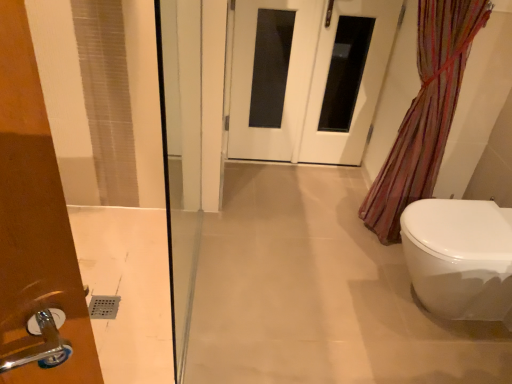
This screenshot has width=512, height=384. In order to click on white glossy door at center in this screenshot , I will do `click(268, 78)`.

What do you see at coordinates (307, 77) in the screenshot? I see `white glossy door at center` at bounding box center [307, 77].

You are a GUI agent. You are given a task and a screenshot of the screen. Output one action in this format:
    pyautogui.click(x=<x>, y=<y>)
    Task: Click on the translucent striped fabric at right
    
    Given the screenshot: What is the action you would take?
    pyautogui.click(x=425, y=113)

Find the location of `door to the right of white glossy door at center`. door to the right of white glossy door at center is located at coordinates (307, 77).

Is white glossy door at center wider or thinner than white glossy door at center?

white glossy door at center is wider than white glossy door at center.

Is white glossy door at center situated inside white glossy door at center or outside?

white glossy door at center is inside white glossy door at center.

Which is in front, white glossy door at center or white glossy door at center?

Positioned in front is white glossy door at center.

Are translucent striped fabric at right and white glossy door at center far apart?

That's not correct — translucent striped fabric at right is a little close to white glossy door at center.

Considering the positions of objects translucent striped fabric at right and white glossy door at center in the image provided, who is more to the left, translucent striped fabric at right or white glossy door at center?

From the viewer's perspective, white glossy door at center appears more on the left side.

What's the angular difference between translucent striped fabric at right and white glossy door at center's facing directions?

The angular difference between translucent striped fabric at right and white glossy door at center is 0.855 degrees.

From the image's perspective, between translucent striped fabric at right and white glossy door at center, which one is located above?

white glossy door at center, from the image's perspective.

Considering the points (418, 28) and (455, 228), which point is behind, point (418, 28) or point (455, 228)?

The point (418, 28) is more distant.

Would you consider translucent striped fabric at right to be distant from white glossy toilet at lower right?

Actually, translucent striped fabric at right and white glossy toilet at lower right are a little close together.

Who is taller, translucent striped fabric at right or white glossy toilet at lower right?

With more height is translucent striped fabric at right.

In terms of width, does translucent striped fabric at right look wider or thinner when compared to white glossy toilet at lower right?

Clearly, translucent striped fabric at right has less width compared to white glossy toilet at lower right.

From the image's perspective, is white glossy door at center under translucent striped fabric at right?

No.

Could you tell me if white glossy door at center is facing translucent striped fabric at right?

No, white glossy door at center is not facing towards translucent striped fabric at right.

Is white glossy door at center next to translucent striped fabric at right?

No, white glossy door at center is not touching translucent striped fabric at right.

Between white glossy door at center and translucent striped fabric at right, which one has more height?

translucent striped fabric at right.

From the image's perspective, is white glossy toilet at lower right located beneath translucent striped fabric at right?

Indeed, from the image's perspective, white glossy toilet at lower right is shown beneath translucent striped fabric at right.

Is the surface of white glossy toilet at lower right in direct contact with translucent striped fabric at right?

No, white glossy toilet at lower right is not in contact with translucent striped fabric at right.

What's the angular difference between white glossy toilet at lower right and translucent striped fabric at right's facing directions?

The facing directions of white glossy toilet at lower right and translucent striped fabric at right are 91 degrees apart.

Could you tell me if white glossy toilet at lower right is turned towards translucent striped fabric at right?

No, white glossy toilet at lower right does not turn towards translucent striped fabric at right.

Is there a large distance between white glossy door at center and white glossy toilet at lower right?

white glossy door at center is positioned a significant distance from white glossy toilet at lower right.

Is white glossy door at center closer to the viewer compared to white glossy toilet at lower right?

That is False.

From a real-world perspective, is white glossy door at center on top of white glossy toilet at lower right?

Yes, from a real-world perspective, white glossy door at center is over white glossy toilet at lower right

Consider the image. Could white glossy toilet at lower right be considered to be inside white glossy door at center?

No, white glossy toilet at lower right is not a part of white glossy door at center.

Is translucent striped fabric at right at the back of white glossy door at center?

That's not correct — white glossy door at center is not looking away from translucent striped fabric at right.

In the scene shown: Is white glossy door at center next to translucent striped fabric at right and touching it?

No, white glossy door at center is not touching translucent striped fabric at right.

I want to click on door behind the translucent striped fabric at right, so click(307, 77).

Identify the location of door to the right of white glossy door at center. click(x=307, y=77).

Locate an element on the screen. This screenshot has height=384, width=512. screen door above the translucent striped fabric at right (from the image's perspective) is located at coordinates (268, 78).

Which object lies further to the anchor point white glossy toilet at lower right, translucent striped fabric at right or white glossy door at center?

white glossy door at center lies further to white glossy toilet at lower right than the other object.

When comparing their distances from white glossy door at center, does white glossy toilet at lower right or translucent striped fabric at right seem further?

white glossy toilet at lower right lies further to white glossy door at center than the other object.

From the image, which object appears to be farther from translucent striped fabric at right, white glossy toilet at lower right or white glossy door at center?

white glossy door at center is further to translucent striped fabric at right.

Which object lies further to the anchor point white glossy toilet at lower right, translucent striped fabric at right or white glossy door at center?

white glossy door at center lies further to white glossy toilet at lower right than the other object.

Looking at the image, which one is located further to white glossy toilet at lower right, white glossy door at center or translucent striped fabric at right?

white glossy door at center is further to white glossy toilet at lower right.

Considering their positions, is white glossy door at center positioned closer to white glossy toilet at lower right than white glossy door at center?

white glossy door at center lies closer to white glossy toilet at lower right than the other object.

From the image, which object appears to be farther from white glossy door at center, translucent striped fabric at right or white glossy door at center?

translucent striped fabric at right is further to white glossy door at center.

Based on the photo, from the image, which object appears to be farther from translucent striped fabric at right, white glossy door at center or white glossy door at center?

Among the two, white glossy door at center is located further to translucent striped fabric at right.

Find the location of a particular element. This screenshot has width=512, height=384. shower curtain that lies between white glossy door at center and white glossy toilet at lower right from top to bottom is located at coordinates (425, 113).

This screenshot has width=512, height=384. In order to click on door positioned between translucent striped fabric at right and white glossy door at center from near to far in this screenshot , I will do `click(307, 77)`.

This screenshot has height=384, width=512. In order to click on screen door between white glossy door at center and white glossy toilet at lower right in the up-down direction in this screenshot , I will do `click(268, 78)`.

Identify the location of shower curtain between white glossy door at center and white glossy toilet at lower right vertically. (425, 113).